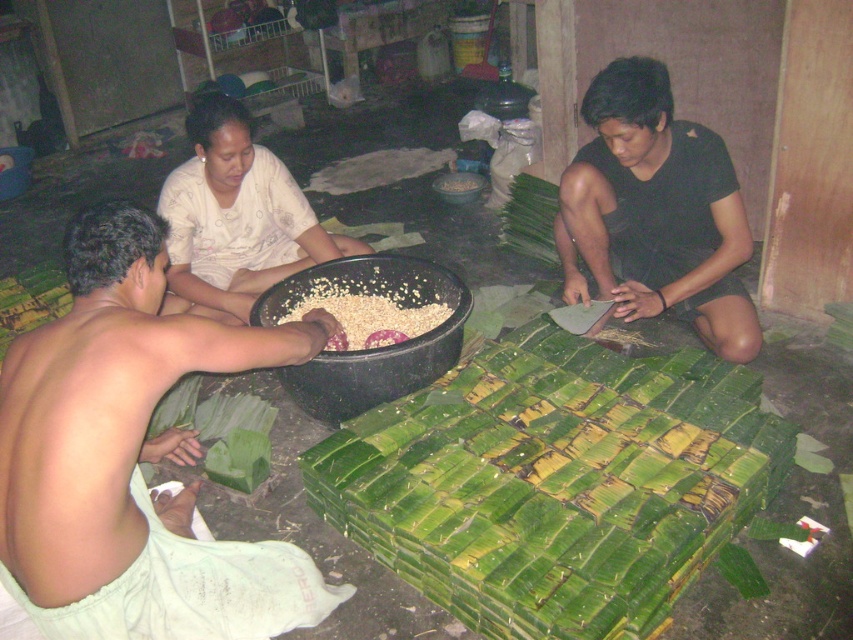
This screenshot has width=853, height=640. I want to click on green leafy bundle at center, so click(x=555, y=483).

This screenshot has height=640, width=853. Describe the element at coordinates (555, 483) in the screenshot. I see `green leafy bundle at center` at that location.

I want to click on green leafy bundle at center, so click(x=555, y=483).

Is black matte shirt at center above white grainy rice at center?

Yes, black matte shirt at center is above white grainy rice at center.

Can you confirm if black matte shirt at center is wider than white grainy rice at center?

Yes.

The image size is (853, 640). I want to click on black matte shirt at center, so click(x=654, y=211).

Can you confirm if green leafy bundle at center is bigger than white fabric at center?

Indeed, green leafy bundle at center has a larger size compared to white fabric at center.

Between green leafy bundle at center and white fabric at center, which one appears on the left side from the viewer's perspective?

From the viewer's perspective, white fabric at center appears more on the left side.

Find the location of a particular element. The image size is (853, 640). green leafy bundle at center is located at coordinates (555, 483).

Identify the location of green leafy bundle at center. [x=555, y=483].